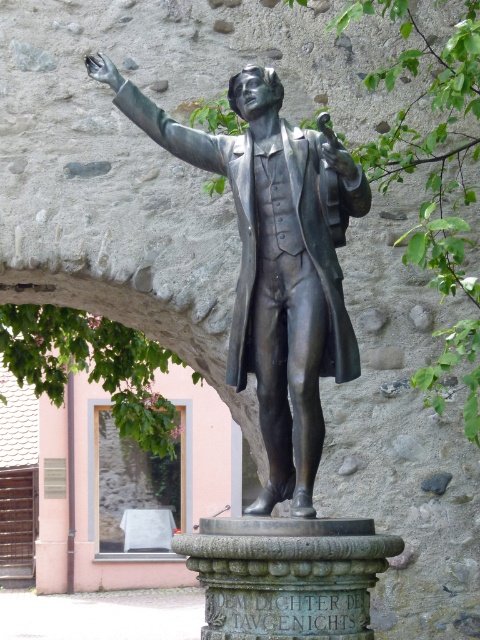
You are an art student analyzing the composition of the image. Which object, the shiny bronze statue at center or the green leafy tree at upper right, has a greater height in the scene?

The green leafy tree at upper right is taller than the shiny bronze statue at center, so the green leafy tree at upper right has a greater height in the scene.

You are an art conservator tasked with placing a protective barrier around the shiny bronze statue at center. The barrier must be positioned at least 1 meter away from the statue in all directions. Given the statue is at coordinates point 0.411, 0.573, where should the barrier be placed?

The shiny bronze statue at center is located at point (275,262). To ensure the barrier is at least 1 meter away in all directions, it should be placed forming a perimeter around these coordinates, maintaining the required distance.

You are an art student analyzing the composition of the statue. From your vantage point, does the shiny bronze statue at center appear closer to you than the green leafy tree at upper right?

Yes, the shiny bronze statue at center is in front of the green leafy tree at upper right, so it appears closer to you.